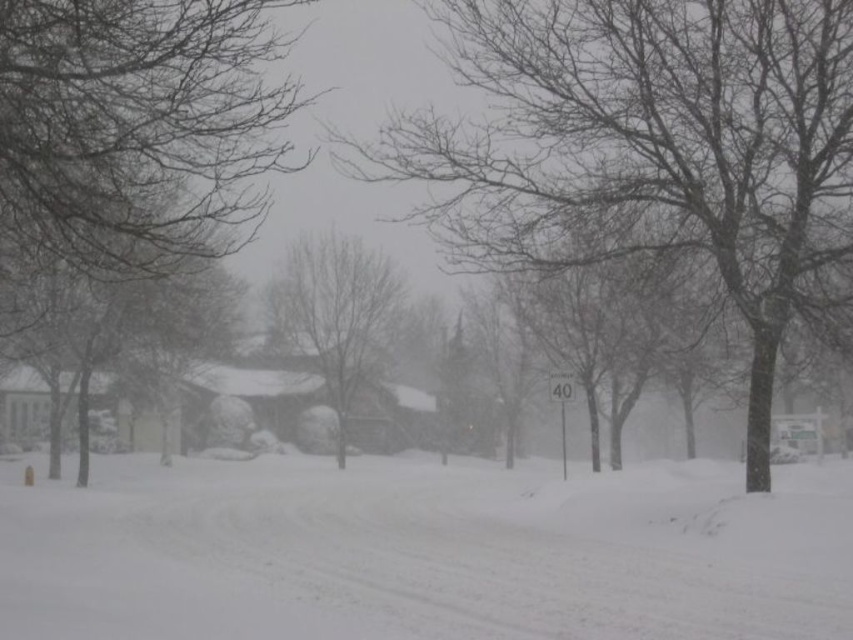
Question: Is white fluffy snow at center smaller than bare branches at left?

Choices:
 (A) yes
 (B) no

Answer: (A)

Question: Where is white fluffy snow at center located in relation to bare branches at left in the image?

Choices:
 (A) above
 (B) below

Answer: (B)

Question: Which point is closer to the camera taking this photo?

Choices:
 (A) (474, 593)
 (B) (137, 64)
 (C) (320, 250)

Answer: (A)

Question: Which point is farther to the camera?

Choices:
 (A) (695, 602)
 (B) (335, 355)
 (C) (7, 180)

Answer: (B)

Question: Where is snow-covered tree at center located in relation to bare branches at left in the image?

Choices:
 (A) below
 (B) above

Answer: (B)

Question: Which of the following is the farthest from the observer?

Choices:
 (A) (328, 353)
 (B) (764, 182)
 (C) (25, 252)

Answer: (A)